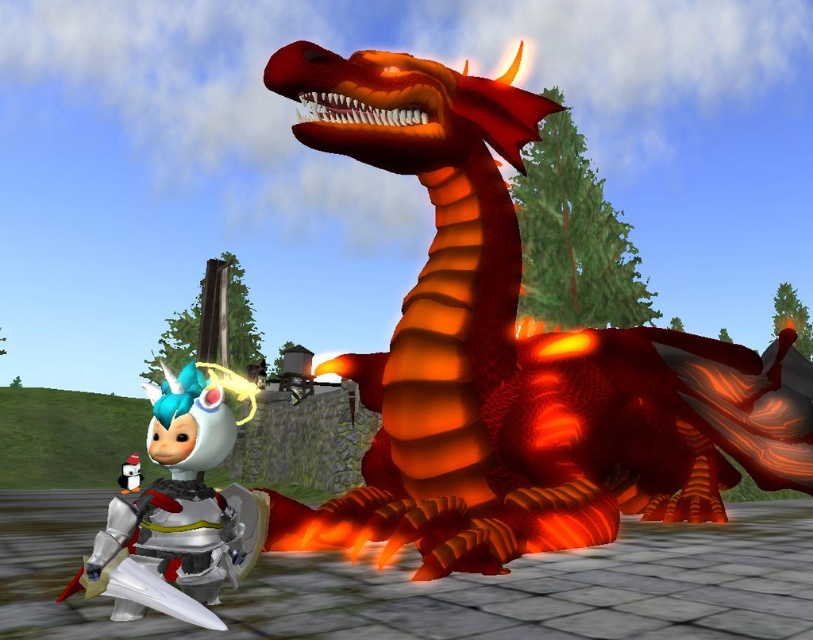
You are a knight in the game who needs to retrieve the metallic silver armor at left. However, there is a shiny orange dragon at center blocking your path. Can you walk under the dragon to reach the armor without getting burned?

The shiny orange dragon at center has a greater height compared to metallic silver armor at left, so yes, the knight can walk under the dragon to reach the armor since the dragon is taller than the armor, providing enough clearance.

You are a character in this video game scene. You see a shiny orange dragon at center. Where is the dragon located relative to the point marked at coordinates (516, 356)?

The dragon is exactly at the point marked at coordinates (516, 356).